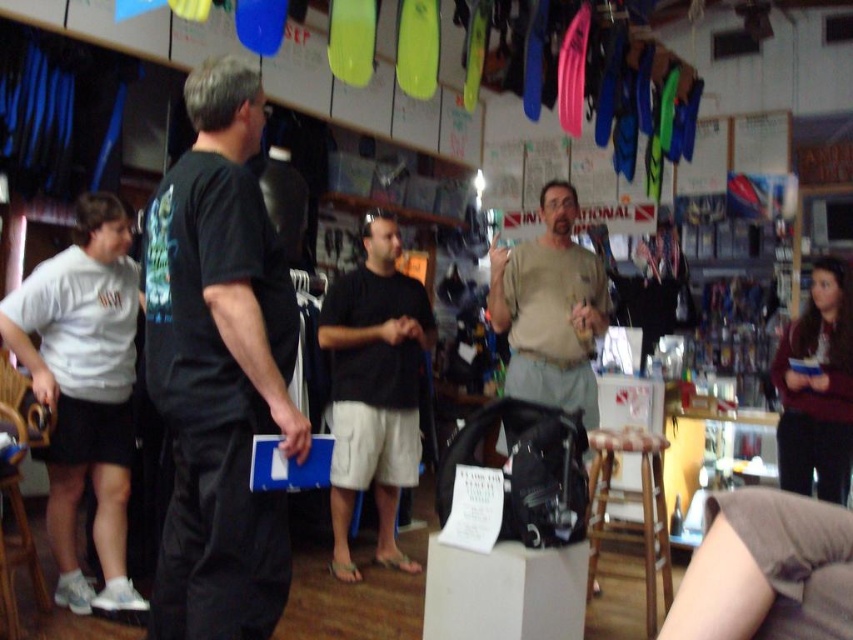
Looking at this image, is white cotton shirt at left to the left of wooden stool at lower right from the viewer's perspective?

Indeed, white cotton shirt at left is positioned on the left side of wooden stool at lower right.

Where is `white cotton shirt at left`? Image resolution: width=853 pixels, height=640 pixels. white cotton shirt at left is located at coordinates (84, 392).

Who is lower down, white cotton shirt at left or black matte shorts at center?

Positioned lower is black matte shorts at center.

Can you confirm if white cotton shirt at left is taller than black matte shorts at center?

Incorrect, white cotton shirt at left's height is not larger of black matte shorts at center's.

Describe the element at coordinates (84, 392) in the screenshot. The image size is (853, 640). I see `white cotton shirt at left` at that location.

Locate an element on the screen. This screenshot has height=640, width=853. white cotton shirt at left is located at coordinates (84, 392).

Does black matte shorts at center appear over light brown cotton shirt at center?

Actually, black matte shorts at center is below light brown cotton shirt at center.

The image size is (853, 640). Identify the location of black matte shorts at center. (374, 388).

Find the location of a particular element. This screenshot has width=853, height=640. black matte shorts at center is located at coordinates (374, 388).